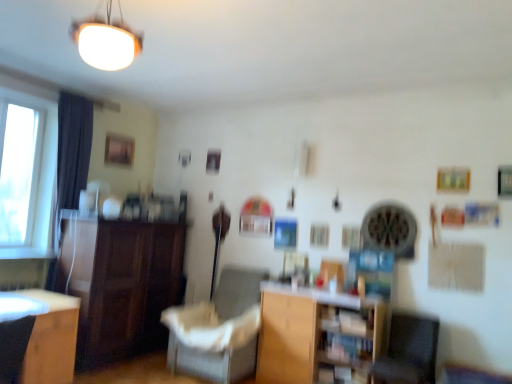
Question: Does dark fabric curtain at left have a smaller size compared to dark wood cabinet at left?

Choices:
 (A) no
 (B) yes

Answer: (B)

Question: Is dark fabric curtain at left at the left side of dark wood cabinet at left?

Choices:
 (A) yes
 (B) no

Answer: (A)

Question: Does dark fabric curtain at left have a larger size compared to dark wood cabinet at left?

Choices:
 (A) no
 (B) yes

Answer: (A)

Question: Is dark fabric curtain at left far away from dark wood cabinet at left?

Choices:
 (A) yes
 (B) no

Answer: (B)

Question: Is dark wood cabinet at left at the back of dark fabric curtain at left?

Choices:
 (A) yes
 (B) no

Answer: (B)

Question: Is dark fabric curtain at left oriented towards dark wood cabinet at left?

Choices:
 (A) no
 (B) yes

Answer: (A)

Question: Is white matte lampshade at upper center thinner than dark gray fabric armchair at lower left?

Choices:
 (A) no
 (B) yes

Answer: (B)

Question: Is white matte lampshade at upper center to the right of dark gray fabric armchair at lower left from the viewer's perspective?

Choices:
 (A) yes
 (B) no

Answer: (A)

Question: From a real-world perspective, is white matte lampshade at upper center beneath dark gray fabric armchair at lower left?

Choices:
 (A) yes
 (B) no

Answer: (B)

Question: Is white matte lampshade at upper center aimed at dark gray fabric armchair at lower left?

Choices:
 (A) yes
 (B) no

Answer: (B)

Question: From the image's perspective, would you say white matte lampshade at upper center is positioned over dark gray fabric armchair at lower left?

Choices:
 (A) no
 (B) yes

Answer: (B)

Question: From the image's perspective, would you say white matte lampshade at upper center is shown under dark gray fabric armchair at lower left?

Choices:
 (A) yes
 (B) no

Answer: (B)

Question: Can you confirm if dark gray fabric armchair at lower left is taller than wooden at center?

Choices:
 (A) no
 (B) yes

Answer: (A)